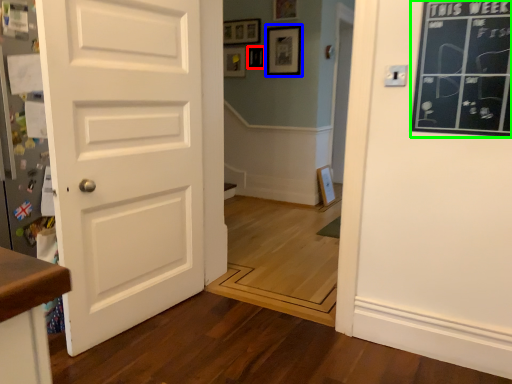
Question: Which object is positioned closest to picture frame (highlighted by a red box)? Select from picture frame (highlighted by a blue box) and bulletin board (highlighted by a green box).

Choices:
 (A) picture frame
 (B) bulletin board

Answer: (A)